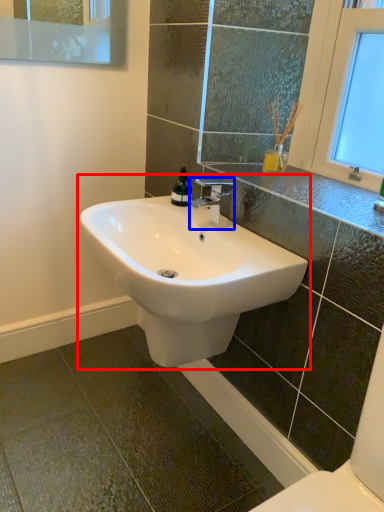
Question: Among these objects, which one is farthest to the camera, sink (highlighted by a red box) or tap (highlighted by a blue box)?

Choices:
 (A) sink
 (B) tap

Answer: (B)